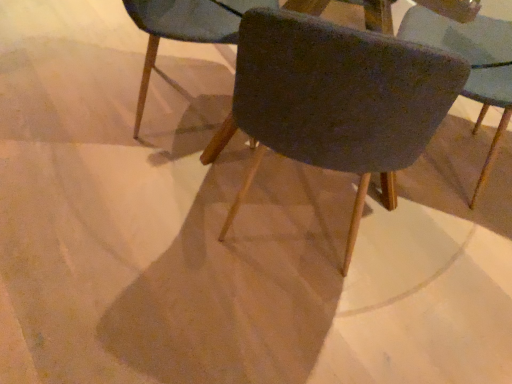
Where is `vacant space situated on the left part of velvet dark blue chair at center, placed as the 2th chair when sorted from left to right`? vacant space situated on the left part of velvet dark blue chair at center, placed as the 2th chair when sorted from left to right is located at coordinates (149, 214).